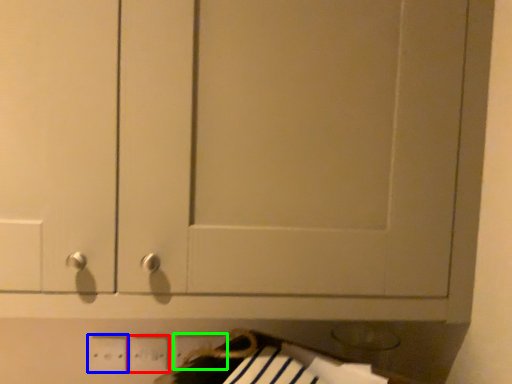
Question: Considering the real-world distances, which object is closest to electric outlet (highlighted by a red box)? electric outlet (highlighted by a blue box) or electric outlet (highlighted by a green box).

Choices:
 (A) electric outlet
 (B) electric outlet

Answer: (A)